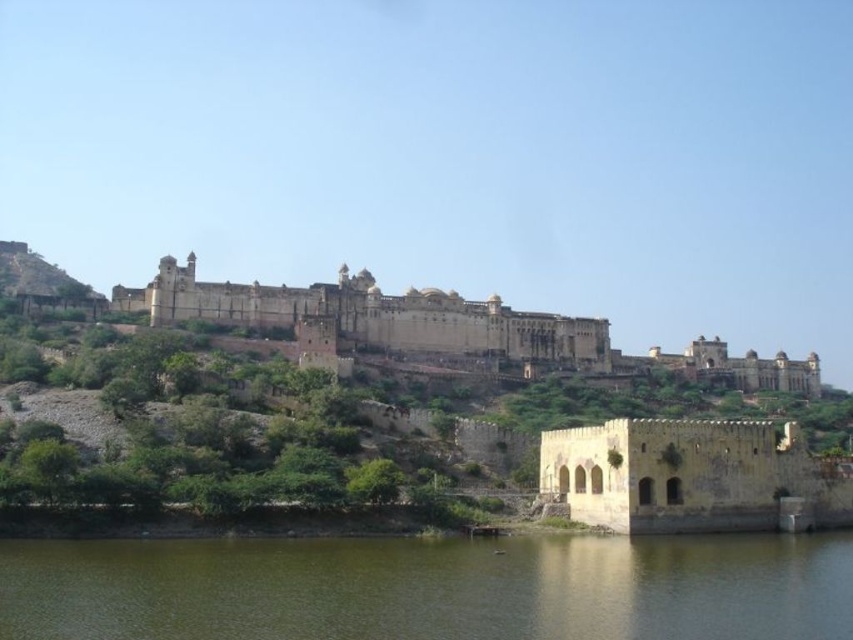
You are a tour guide leading a group from the yellow stone fort at lower right to the brown stone palace at center. The group has a 300 feet walking limit. Can you safely lead them to the palace without exceeding the limit?

The distance between the yellow stone fort at lower right and the brown stone palace at center is 249.24 feet, which is under the 300 feet limit. Yes, you can safely lead the group to the palace without exceeding the walking limit.

You are standing at the base of the hill looking up at the historic fort. There is a point marked at coordinates (691, 476). Which part of the fort does this point correspond to?

The point at coordinates (691, 476) is located on the yellow stone fort at lower right.

You are standing at the base of the hill looking up at the fort. Which object is closer to you between the greenish water at lower center and the brown stone palace at center?

The greenish water at lower center is closer to the viewer than the brown stone palace at center.